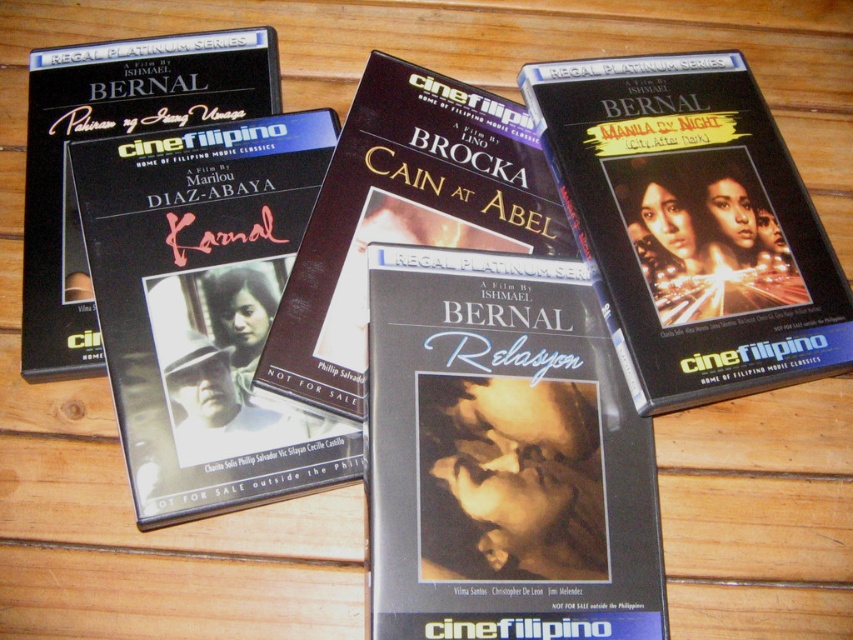
Question: Which point is closer to the camera?

Choices:
 (A) (610, 125)
 (B) (251, 92)
 (C) (267, 241)
 (D) (531, 477)

Answer: (D)

Question: Is matte black dvd case at center thinner than matte black book at center?

Choices:
 (A) no
 (B) yes

Answer: (B)

Question: Is matte black dvd at center below matte black dvd case at center?

Choices:
 (A) no
 (B) yes

Answer: (B)

Question: Which object is closer to the camera taking this photo?

Choices:
 (A) matte black dvd case at upper right
 (B) matte black dvd at upper left
 (C) matte black dvd case at center
 (D) matte black dvd at center

Answer: (D)

Question: Which of these objects is positioned closest to the matte black dvd at upper left?

Choices:
 (A) matte black dvd at center
 (B) matte black dvd case at center

Answer: (B)

Question: Where is matte black dvd at center located in relation to matte black dvd case at center in the image?

Choices:
 (A) above
 (B) below

Answer: (B)